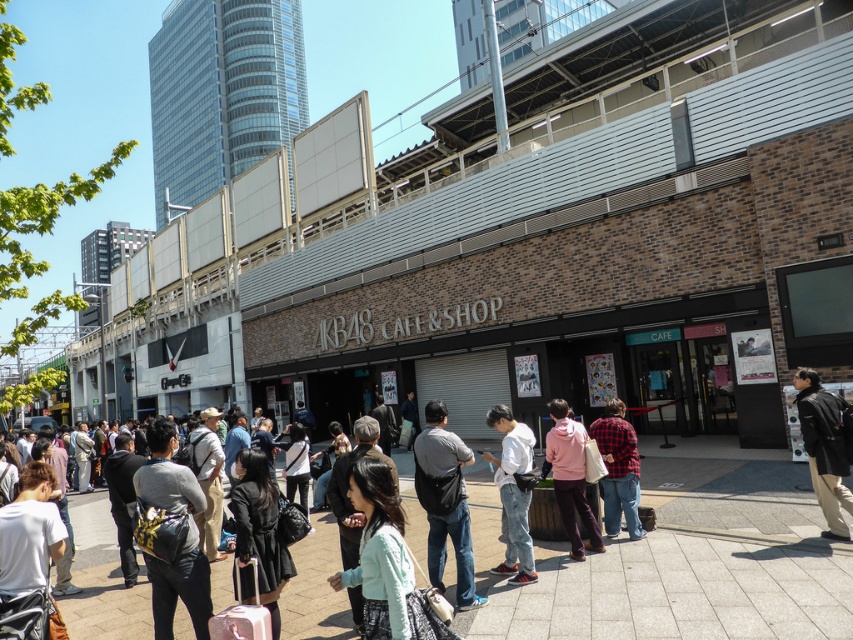
Question: Is white matte jacket at center further to the viewer compared to pink fleece jacket at center?

Choices:
 (A) yes
 (B) no

Answer: (B)

Question: Which point appears closest to the camera in this image?

Choices:
 (A) (567, 438)
 (B) (202, 496)

Answer: (B)

Question: Is light gray concrete pavement at center smaller than black leather jacket at lower right?

Choices:
 (A) yes
 (B) no

Answer: (B)

Question: Considering the relative positions of pink fleece jacket at center and red plaid shirt at center in the image provided, where is pink fleece jacket at center located with respect to red plaid shirt at center?

Choices:
 (A) above
 (B) below

Answer: (A)

Question: Which point appears farthest from the camera in this image?

Choices:
 (A) (596, 545)
 (B) (180, 499)

Answer: (A)

Question: Considering the real-world distances, which object is closest to the black leather jacket at lower right?

Choices:
 (A) light gray concrete pavement at center
 (B) white matte jacket at center
 (C) leather backpack at center
 (D) pink fleece jacket at center

Answer: (A)